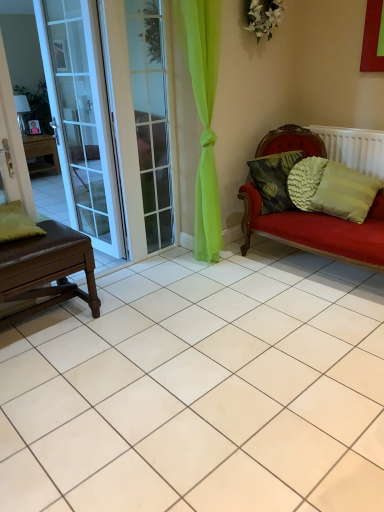
Describe the element at coordinates (274, 180) in the screenshot. Image resolution: width=384 pixels, height=512 pixels. I see `textured green pillow at right, marked as the third pillow in a right-to-left arrangement` at that location.

Where is `white glass door at left`? The width and height of the screenshot is (384, 512). white glass door at left is located at coordinates (81, 118).

This screenshot has width=384, height=512. What do you see at coordinates (16, 222) in the screenshot?
I see `green matte pillow at left, placed as the first pillow when sorted from left to right` at bounding box center [16, 222].

At what (x,y) coordinates should I click in order to perform the action: click on green matte pillow at left, placed as the first pillow when sorted from left to right. Please return your answer as a coordinate pair (x, y). The height and width of the screenshot is (512, 384). Looking at the image, I should click on (16, 222).

Describe the element at coordinates (143, 121) in the screenshot. This screenshot has height=512, width=384. I see `clear glass screen door at left` at that location.

Identify the location of textured green pillow at right, which is counted as the 2th pillow, starting from the right. The width and height of the screenshot is (384, 512). (305, 181).

Image resolution: width=384 pixels, height=512 pixels. In order to click on screen door above the white plastic radiator at right (from the image's perspective) in this screenshot , I will do `click(143, 121)`.

Between point (112, 106) and point (331, 156), which one is positioned in front?

The point (112, 106) is closer to the camera.

Which of these two, clear glass screen door at left or white plastic radiator at right, stands shorter?

Standing shorter between the two is white plastic radiator at right.

Is clear glass screen door at left to the left or to the right of white plastic radiator at right in the image?

From the image, it's evident that clear glass screen door at left is to the left of white plastic radiator at right.

How distant is white plastic radiator at right from green matte pillow at left, the fourth pillow in the right-to-left sequence?

white plastic radiator at right and green matte pillow at left, the fourth pillow in the right-to-left sequence, are 7.54 feet apart.

Between white plastic radiator at right and green matte pillow at left, the fourth pillow in the right-to-left sequence, which one has smaller size?

green matte pillow at left, the fourth pillow in the right-to-left sequence, is smaller.

Considering the positions of objects white plastic radiator at right and green matte pillow at left, placed as the first pillow when sorted from left to right, in the image provided, who is more to the left, white plastic radiator at right or green matte pillow at left, placed as the first pillow when sorted from left to right,?

From the viewer's perspective, green matte pillow at left, placed as the first pillow when sorted from left to right, appears more on the left side.

Would you say white plastic radiator at right is inside or outside green matte pillow at left, placed as the first pillow when sorted from left to right?

white plastic radiator at right is not inside green matte pillow at left, placed as the first pillow when sorted from left to right, it's outside.

Looking at this image, does clear glass screen door at left appear on the right side of green matte pillow at left, placed as the first pillow when sorted from left to right?

Yes, clear glass screen door at left is to the right of green matte pillow at left, placed as the first pillow when sorted from left to right.

Measure the distance from clear glass screen door at left to green matte pillow at left, placed as the first pillow when sorted from left to right.

A distance of 1.09 meters exists between clear glass screen door at left and green matte pillow at left, placed as the first pillow when sorted from left to right.

In the scene shown: Is clear glass screen door at left situated inside green matte pillow at left, the fourth pillow in the right-to-left sequence, or outside?

clear glass screen door at left exists outside the volume of green matte pillow at left, the fourth pillow in the right-to-left sequence.

Can you confirm if clear glass screen door at left is smaller than green matte pillow at left, the fourth pillow in the right-to-left sequence?

Actually, clear glass screen door at left might be larger than green matte pillow at left, the fourth pillow in the right-to-left sequence.

Does textured green pillow at right, the third pillow when ordered from left to right, have a greater height compared to green matte pillow at left, placed as the first pillow when sorted from left to right?

Yes, textured green pillow at right, the third pillow when ordered from left to right, is taller than green matte pillow at left, placed as the first pillow when sorted from left to right.

Is textured green pillow at right, the third pillow when ordered from left to right, aimed at green matte pillow at left, placed as the first pillow when sorted from left to right?

No, textured green pillow at right, the third pillow when ordered from left to right, is not aimed at green matte pillow at left, placed as the first pillow when sorted from left to right.

Can you tell me how much textured green pillow at right, which is counted as the 2th pillow, starting from the right, and green matte pillow at left, the fourth pillow in the right-to-left sequence, differ in facing direction?

textured green pillow at right, which is counted as the 2th pillow, starting from the right, and green matte pillow at left, the fourth pillow in the right-to-left sequence, are facing 47.5 degrees away from each other.

Can you confirm if textured green pillow at right, which is counted as the 2th pillow, starting from the right, is thinner than green matte pillow at left, the fourth pillow in the right-to-left sequence?

Correct, the width of textured green pillow at right, which is counted as the 2th pillow, starting from the right, is less than that of green matte pillow at left, the fourth pillow in the right-to-left sequence.

Looking at this image, considering the sizes of white glass door at left and textured green pillow at right, which is counted as the 2th pillow, starting from the left, in the image, is white glass door at left taller or shorter than textured green pillow at right, which is counted as the 2th pillow, starting from the left,?

white glass door at left is taller than textured green pillow at right, which is counted as the 2th pillow, starting from the left.

From the image's perspective, would you say white glass door at left is shown under textured green pillow at right, which is counted as the 2th pillow, starting from the left?

Incorrect, from the image's perspective, white glass door at left is higher than textured green pillow at right, which is counted as the 2th pillow, starting from the left.

Does point (78, 71) come in front of point (248, 166)?

Yes, point (78, 71) is in front of point (248, 166).

From a real-world perspective, is white glass door at left physically located above or below textured green pillow at right, marked as the third pillow in a right-to-left arrangement?

white glass door at left is situated higher than textured green pillow at right, marked as the third pillow in a right-to-left arrangement, in the real world.

From the image's perspective, which pillow is the 1st one below the clear glass screen door at left? Please provide its 2D coordinates.

[(274, 180)]

From their relative heights in the image, would you say clear glass screen door at left is taller or shorter than textured green pillow at right, marked as the third pillow in a right-to-left arrangement?

Clearly, clear glass screen door at left is taller compared to textured green pillow at right, marked as the third pillow in a right-to-left arrangement.

From a real-world perspective, which object stands above the other?

clear glass screen door at left, from a real-world perspective.

From the image's perspective, is brown leather table at left located beneath clear glass screen door at left?

Indeed, from the image's perspective, brown leather table at left is shown beneath clear glass screen door at left.

Which object is more forward, brown leather table at left or clear glass screen door at left?

brown leather table at left is more forward.

From a real-world perspective, is brown leather table at left located beneath clear glass screen door at left?

Yes, from a real-world perspective, brown leather table at left is under clear glass screen door at left.

In the scene shown: Is brown leather table at left shorter than clear glass screen door at left?

Yes.

At what (x,y) coordinates should I click in order to perform the action: click on radiator beneath the clear glass screen door at left (from a real-world perspective). Please return your answer as a coordinate pair (x, y). Image resolution: width=384 pixels, height=512 pixels. Looking at the image, I should click on (354, 148).

From the image's perspective, count 4th pillows downward from the white plastic radiator at right and point to it. Please provide its 2D coordinates.

[(16, 222)]

Considering their positions, is green matte pillow at left, the fourth pillow in the right-to-left sequence, positioned further to white glass door at left than textured green pillow at right, which is counted as the 2th pillow, starting from the left?

The object further to white glass door at left is textured green pillow at right, which is counted as the 2th pillow, starting from the left.

Estimate the real-world distances between objects in this image. Which object is further from white plastic radiator at right, green textured pillow at right, positioned as the 4th pillow in left-to-right order, or textured green pillow at right, which is counted as the 2th pillow, starting from the left?

textured green pillow at right, which is counted as the 2th pillow, starting from the left, is further to white plastic radiator at right.

From the image, which object appears to be nearer to textured green pillow at right, the third pillow when ordered from left to right, white glass door at left or green textured pillow at right, positioned as the 4th pillow in left-to-right order?

The object closer to textured green pillow at right, the third pillow when ordered from left to right, is green textured pillow at right, positioned as the 4th pillow in left-to-right order.

Considering their positions, is textured green pillow at right, which is counted as the 2th pillow, starting from the right, positioned closer to green matte pillow at left, the fourth pillow in the right-to-left sequence, than brown leather table at left?

brown leather table at left is closer to green matte pillow at left, the fourth pillow in the right-to-left sequence.

When comparing their distances from white glass door at left, does white plastic radiator at right or green matte pillow at left, the fourth pillow in the right-to-left sequence, seem further?

white plastic radiator at right is positioned further to the anchor white glass door at left.

Estimate the real-world distances between objects in this image. Which object is further from white plastic radiator at right, clear glass screen door at left or textured green pillow at right, which is counted as the 2th pillow, starting from the right?

clear glass screen door at left is further to white plastic radiator at right.

Estimate the real-world distances between objects in this image. Which object is further from textured green pillow at right, which is counted as the 2th pillow, starting from the left, brown leather table at left or green textured pillow at right, positioned as the 4th pillow in left-to-right order?

brown leather table at left is further to textured green pillow at right, which is counted as the 2th pillow, starting from the left.

Looking at the image, which one is located closer to white plastic radiator at right, green textured pillow at right, positioned as the 4th pillow in left-to-right order, or green matte pillow at left, the fourth pillow in the right-to-left sequence?

green textured pillow at right, positioned as the 4th pillow in left-to-right order, is positioned closer to the anchor white plastic radiator at right.

At what (x,y) coordinates should I click in order to perform the action: click on pillow situated between textured green pillow at right, which is counted as the 2th pillow, starting from the left, and green textured pillow at right, positioned as the 4th pillow in left-to-right order, from left to right. Please return your answer as a coordinate pair (x, y). The image size is (384, 512). Looking at the image, I should click on (305, 181).

At what (x,y) coordinates should I click in order to perform the action: click on screen door between brown leather table at left and white plastic radiator at right in the horizontal direction. Please return your answer as a coordinate pair (x, y). Looking at the image, I should click on (143, 121).

Find the location of a particular element. The image size is (384, 512). screen door between green matte pillow at left, placed as the first pillow when sorted from left to right, and green textured pillow at right, positioned as the 4th pillow in left-to-right order, in the horizontal direction is located at coordinates (143, 121).

Find the location of a particular element. This screenshot has height=512, width=384. screen door between brown leather table at left and green textured pillow at right, positioned as the 4th pillow in left-to-right order, from left to right is located at coordinates (143, 121).